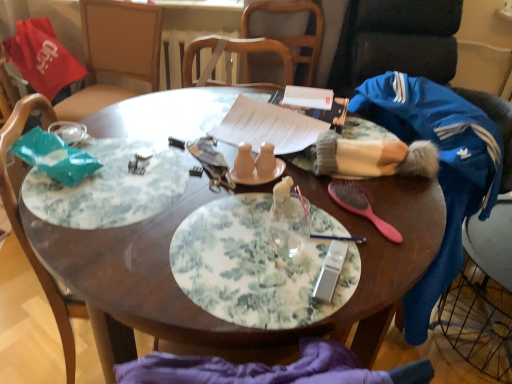
Image resolution: width=512 pixels, height=384 pixels. Identify the location of free space to the back side of pink plastic hairbrush at center-right, which is the fifth tableware from left to right. (371, 182).